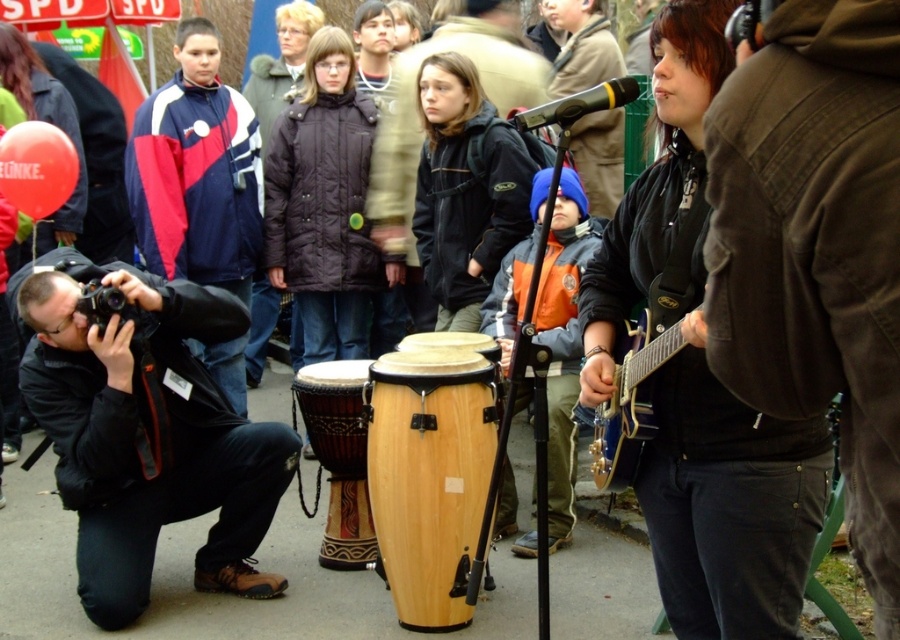
Between black fabric camera at lower left and matte blue and red jacket at left, which one has more height?

matte blue and red jacket at left is taller.

Who is positioned more to the right, black fabric camera at lower left or matte blue and red jacket at left?

Positioned to the right is black fabric camera at lower left.

Locate an element on the screen. black fabric camera at lower left is located at coordinates (147, 432).

You are a GUI agent. You are given a task and a screenshot of the screen. Output one action in this format:
    pyautogui.click(x=<x>, y=<y>)
    Task: Click on the black fabric camera at lower left
    The width and height of the screenshot is (900, 640).
    Given the screenshot: What is the action you would take?
    (x=147, y=432)

Is point (483, 392) in front of point (203, 54)?

Yes, point (483, 392) is closer to viewer.

Which is in front, point (430, 492) or point (201, 131)?

Point (430, 492) is more forward.

Locate an element on the screen. This screenshot has width=900, height=640. natural wood drum at center is located at coordinates (429, 476).

Between natural wood drum at center and black matte jacket at center, which one is positioned lower?

Positioned lower is natural wood drum at center.

In the scene shown: Is natural wood drum at center behind black matte jacket at center?

No, natural wood drum at center is in front of black matte jacket at center.

At what (x,y) coordinates should I click in order to perform the action: click on natural wood drum at center. Please return your answer as a coordinate pair (x, y). Image resolution: width=900 pixels, height=640 pixels. Looking at the image, I should click on (429, 476).

Locate an element on the screen. natural wood drum at center is located at coordinates (429, 476).